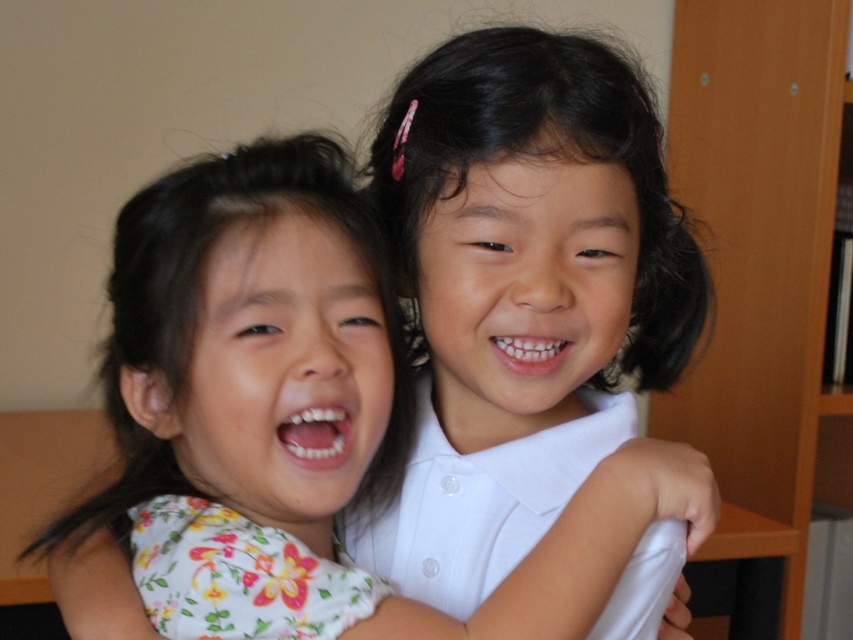
You are a photographer trying to capture a candid shot of the two children. You notice two points marked in the image. The first point is at coordinates point (x=543, y=440) and the second is at point (x=325, y=524). Which point is closer to the camera based on their positions?

Point (x=543, y=440) is in front of point (x=325, y=524), so it is closer to the camera.

What is the object located at the coordinate point [251,344] in the image?

The point [251,344] corresponds to the floral fabric shirt at center.